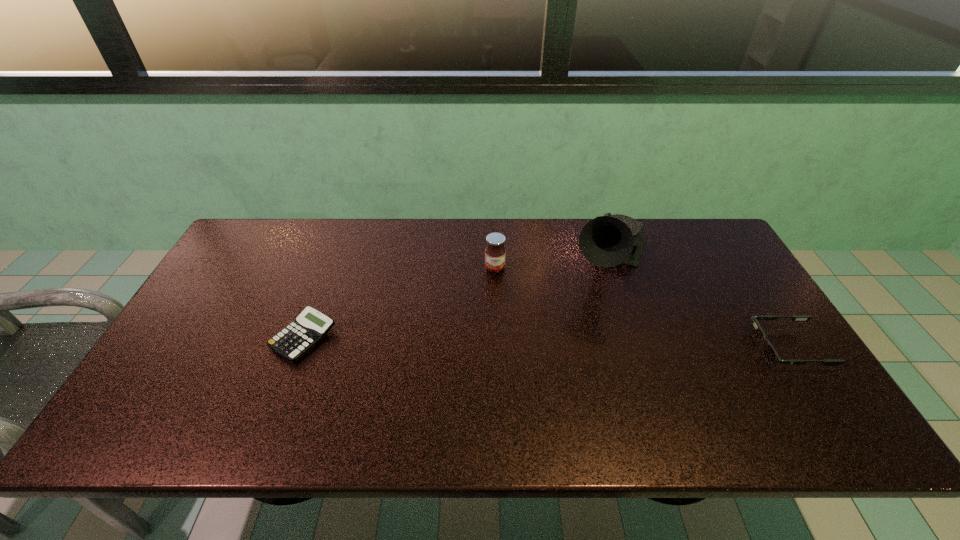
Identify the location of free space located 0.200m on the temples of the sunglasses. (679, 348).

The height and width of the screenshot is (540, 960). Find the location of `free space located 0.330m on the temples of the sunglasses`. free space located 0.330m on the temples of the sunglasses is located at coordinates (629, 348).

This screenshot has width=960, height=540. Find the location of `vacant space situated on the label side of the jam`. vacant space situated on the label side of the jam is located at coordinates (500, 336).

The height and width of the screenshot is (540, 960). Identify the location of free spot located on the label side of the jam. (501, 339).

Identify the location of free space located 0.050m on the label side of the jam. (496, 286).

The width and height of the screenshot is (960, 540). I want to click on free point located from the horn of the third object from left to right, so click(x=576, y=367).

The height and width of the screenshot is (540, 960). Identify the location of vacant space located from the horn of the third object from left to right. (596, 311).

Identify the location of vacant space located 0.120m from the horn of the third object from left to right. (591, 326).

You are a GUI agent. You are given a task and a screenshot of the screen. Output one action in this format:
    pyautogui.click(x=<x>, y=<y>)
    Task: Click on the jam situated at the far edge
    Image resolution: width=960 pixels, height=540 pixels.
    Given the screenshot: What is the action you would take?
    pyautogui.click(x=495, y=252)

Identify the location of phonograph_record at the far edge. (606, 241).